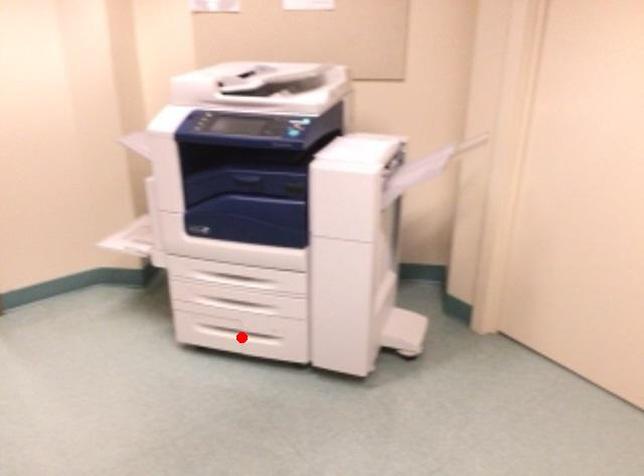
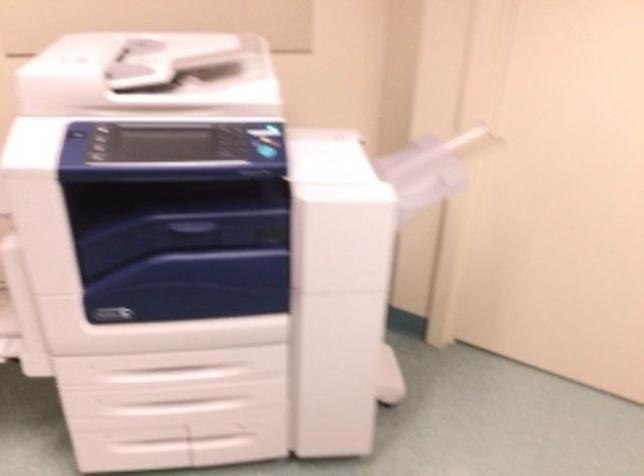
Question: I am providing you with two images of the same scene from different viewpoints. A red point is marked on the first image. Is the red point's position out of view in image 2?

Choices:
 (A) Yes
 (B) No

Answer: (B)